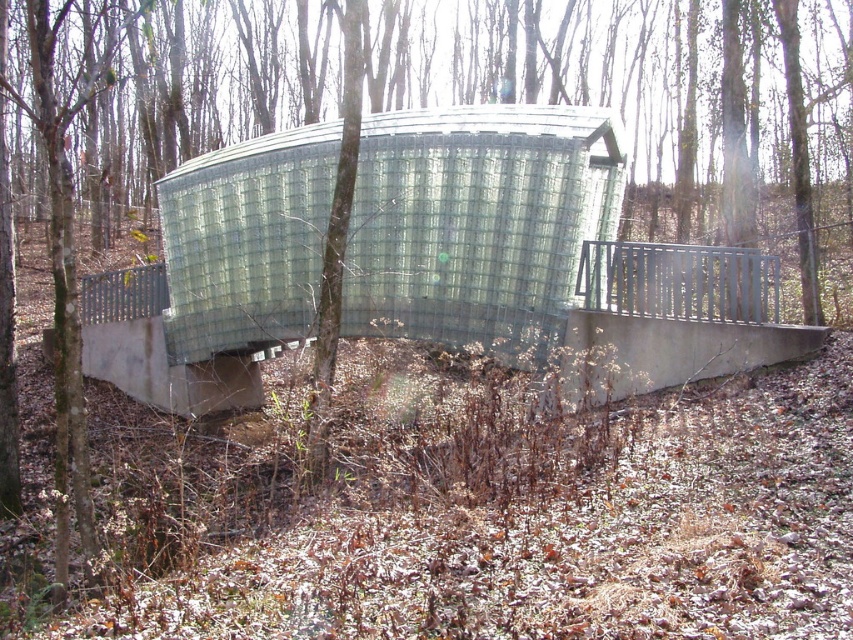
Describe the element at coordinates (477, 220) in the screenshot. I see `clear glass shelter at center` at that location.

Find the location of a particular element. The height and width of the screenshot is (640, 853). clear glass shelter at center is located at coordinates (477, 220).